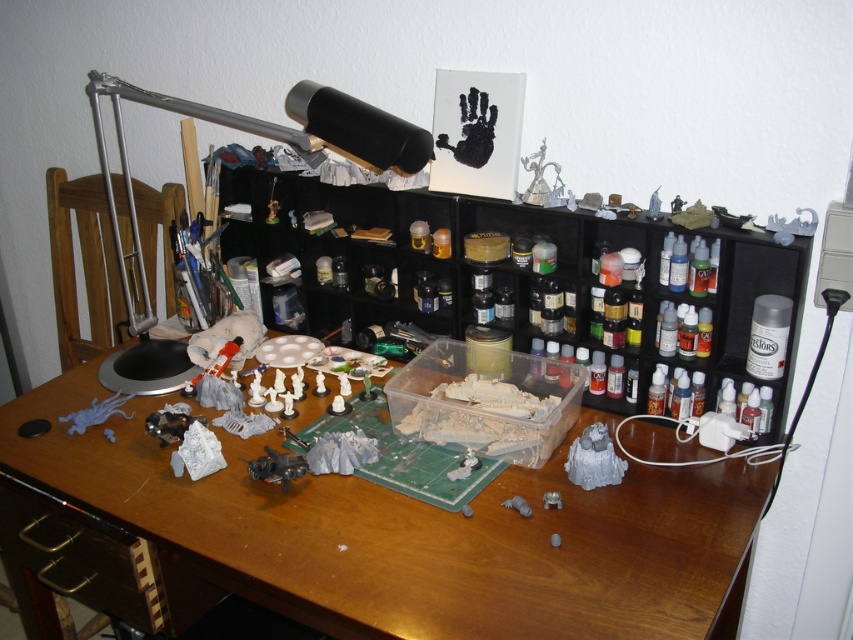
Question: Can you confirm if black plastic shelf at center is wider than wooden drawer at lower left?

Choices:
 (A) no
 (B) yes

Answer: (B)

Question: Estimate the real-world distances between objects in this image. Which object is farther from the wooden at center?

Choices:
 (A) silver metallic desk lamp at upper left
 (B) wooden drawer at lower left
 (C) black plastic shelf at center

Answer: (A)

Question: Which of the following is the closest to the observer?

Choices:
 (A) (228, 116)
 (B) (544, 513)

Answer: (B)

Question: Does wooden at center appear under black plastic shelf at center?

Choices:
 (A) no
 (B) yes

Answer: (B)

Question: Does wooden at center lie behind silver metallic desk lamp at upper left?

Choices:
 (A) yes
 (B) no

Answer: (B)

Question: Among these objects, which one is nearest to the camera?

Choices:
 (A) silver metallic desk lamp at upper left
 (B) wooden at center

Answer: (B)